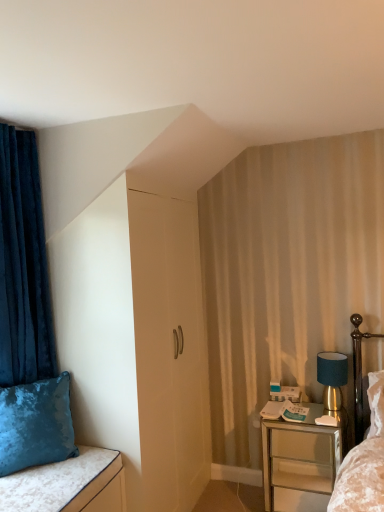
Question: Does velvet blue pillow at lower left appear on the right side of metallic silver nightstand at lower right?

Choices:
 (A) no
 (B) yes

Answer: (A)

Question: Does velvet blue pillow at lower left have a larger size compared to metallic silver nightstand at lower right?

Choices:
 (A) yes
 (B) no

Answer: (B)

Question: From the image's perspective, is velvet blue pillow at lower left on top of metallic silver nightstand at lower right?

Choices:
 (A) no
 (B) yes

Answer: (B)

Question: Is velvet blue pillow at lower left not inside metallic silver nightstand at lower right?

Choices:
 (A) yes
 (B) no

Answer: (A)

Question: Is velvet blue pillow at lower left directly adjacent to metallic silver nightstand at lower right?

Choices:
 (A) yes
 (B) no

Answer: (B)

Question: Does velvet blue pillow at lower left have a greater height compared to metallic silver nightstand at lower right?

Choices:
 (A) no
 (B) yes

Answer: (A)

Question: Is velvet blue curtain at left completely or partially inside velvet blue pillow at lower left?

Choices:
 (A) no
 (B) yes

Answer: (A)

Question: Is velvet blue pillow at lower left to the left of velvet blue curtain at left from the viewer's perspective?

Choices:
 (A) yes
 (B) no

Answer: (B)

Question: Could you tell me if velvet blue pillow at lower left is facing velvet blue curtain at left?

Choices:
 (A) yes
 (B) no

Answer: (A)

Question: From a real-world perspective, is velvet blue pillow at lower left on velvet blue curtain at left?

Choices:
 (A) yes
 (B) no

Answer: (B)

Question: Considering the relative sizes of velvet blue pillow at lower left and velvet blue curtain at left in the image provided, is velvet blue pillow at lower left bigger than velvet blue curtain at left?

Choices:
 (A) no
 (B) yes

Answer: (A)

Question: Are velvet blue pillow at lower left and velvet blue curtain at left making contact?

Choices:
 (A) yes
 (B) no

Answer: (B)

Question: Is teal fabric lampshade at right behind velvet blue pillow at lower left?

Choices:
 (A) yes
 (B) no

Answer: (A)